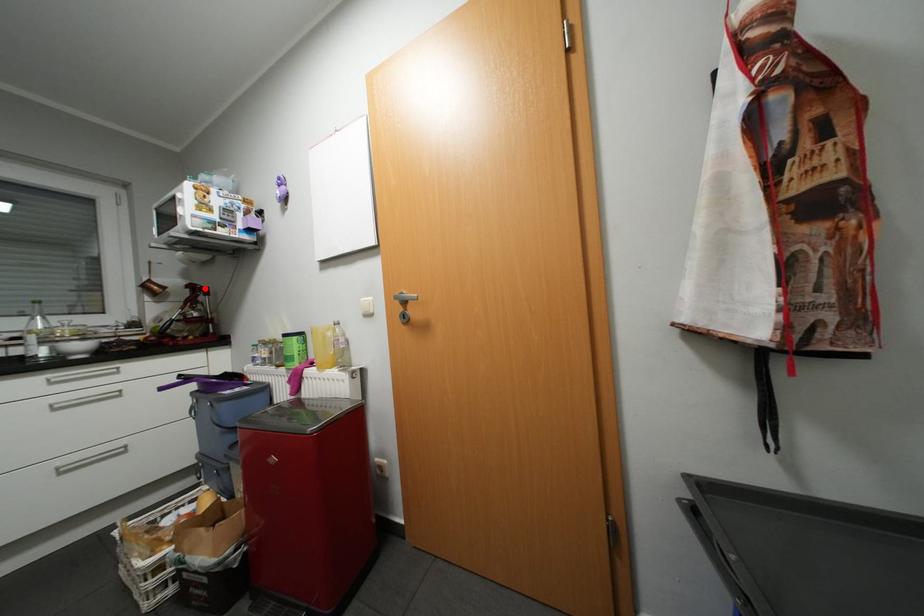
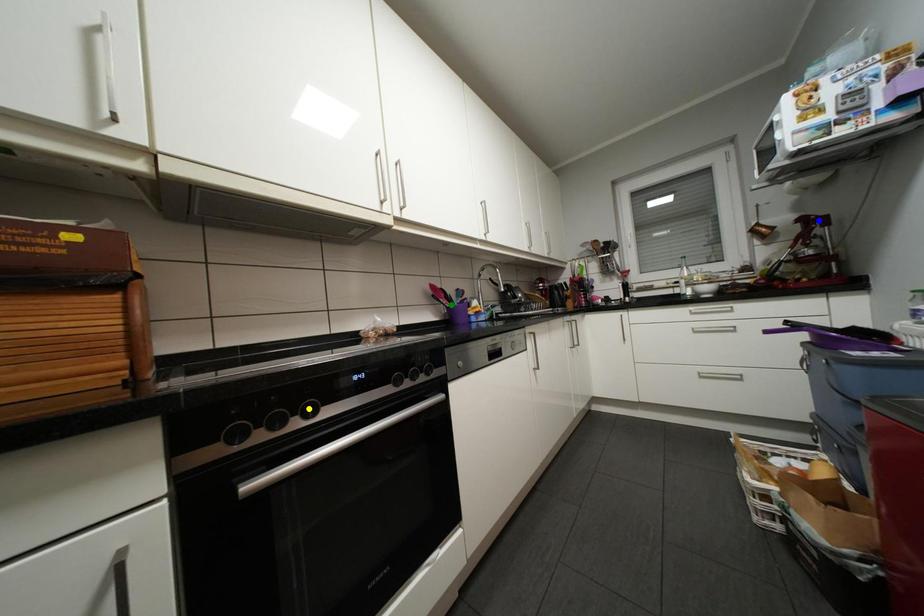
Question: I am providing you with two images of the same scene from different viewpoints. A red point is marked on the first image. You are given multiple points on the second image. In image 2, which mark is for the same physical point as the one in image 1?

Choices:
 (A) yellow point
 (B) blue point
 (C) green point

Answer: (B)